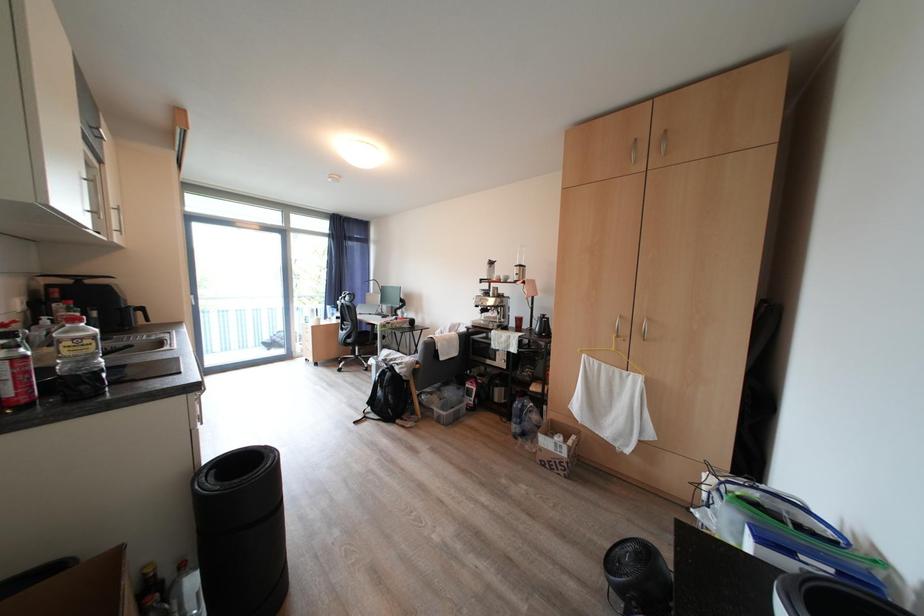
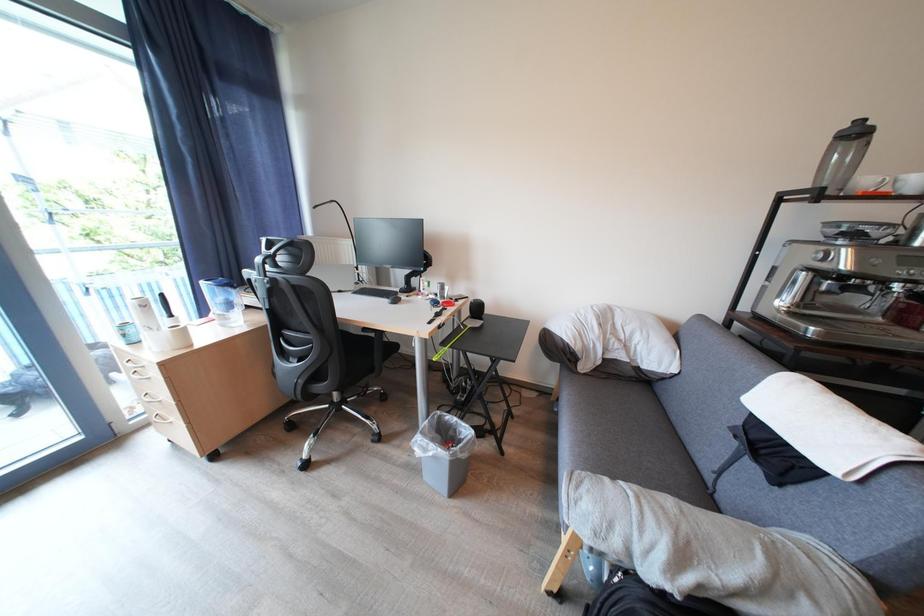
Consider the image. What movement of the cameraman would produce the second image?

The cameraman moved toward left, forward.